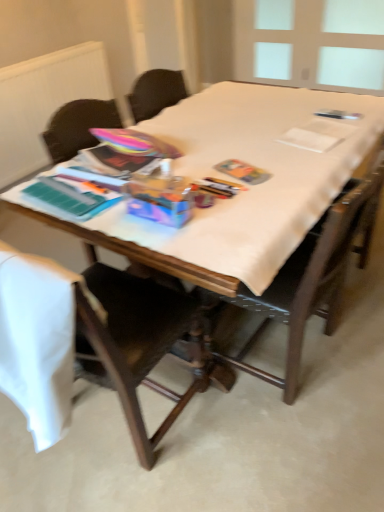
Question: In the image, is white matte radiator at upper left on the left side or the right side of transparent plastic window screen at upper right?

Choices:
 (A) right
 (B) left

Answer: (B)

Question: Is white matte radiator at upper left spatially inside transparent plastic window screen at upper right, or outside of it?

Choices:
 (A) outside
 (B) inside

Answer: (A)

Question: Which object is positioned farthest from the white matte radiator at upper left?

Choices:
 (A) wooden table at center
 (B) wooden chair at center, placed as the 1th chair when sorted from right to left
 (C) transparent plastic window screen at upper right
 (D) wooden chair at left, the first chair when ordered from left to right

Answer: (B)

Question: Which object is positioned farthest from the wooden chair at center, placed as the 2th chair when sorted from left to right?

Choices:
 (A) transparent plastic window screen at upper right
 (B) wooden chair at left, which is the 2th chair in right-to-left order
 (C) wooden table at center
 (D) white matte radiator at upper left

Answer: (A)